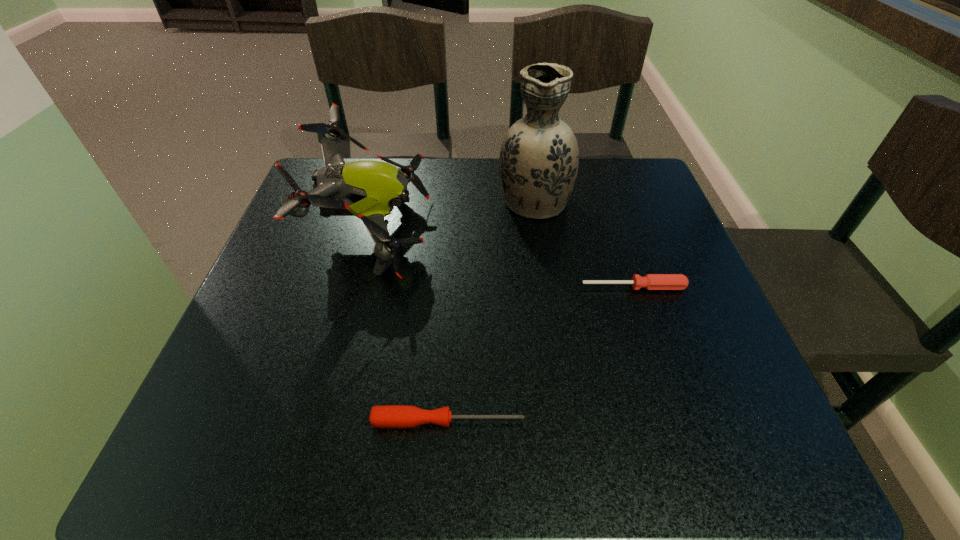
Identify the location of vacant space located at the tip of the left screwdriver. The height and width of the screenshot is (540, 960). (654, 421).

Where is `vase that is positioned at the far edge`? The image size is (960, 540). vase that is positioned at the far edge is located at coordinates (539, 158).

The width and height of the screenshot is (960, 540). I want to click on drone present at the far edge, so click(367, 189).

At what (x,y) coordinates should I click in order to perform the action: click on object present at the near edge. Please return your answer as a coordinate pair (x, y). This screenshot has width=960, height=540. Looking at the image, I should click on (388, 416).

This screenshot has width=960, height=540. I want to click on object that is at the left edge, so click(367, 189).

Where is `object that is at the right edge`? object that is at the right edge is located at coordinates (651, 281).

You are a GUI agent. You are given a task and a screenshot of the screen. Output one action in this format:
    pyautogui.click(x=<x>, y=<y>)
    Task: Click on the object present at the far left corner
    Image resolution: width=960 pixels, height=540 pixels.
    Given the screenshot: What is the action you would take?
    pyautogui.click(x=367, y=189)

Locate an element on the screen. This screenshot has height=540, width=960. vacant space at the far edge of the desktop is located at coordinates (579, 210).

Image resolution: width=960 pixels, height=540 pixels. What are the coordinates of `free space at the near edge of the desktop` in the screenshot? It's located at (308, 426).

In order to click on free space at the right edge in this screenshot , I will do `click(617, 245)`.